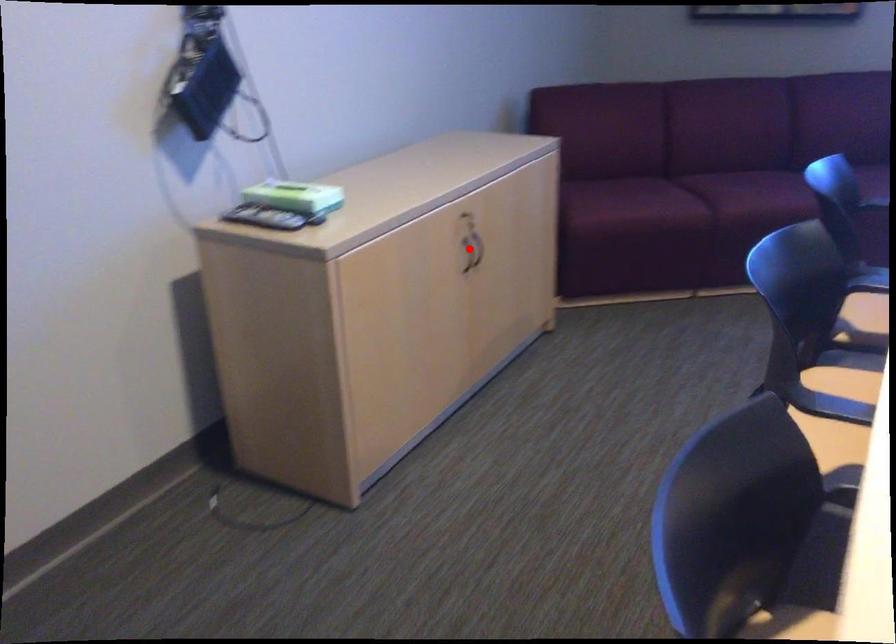
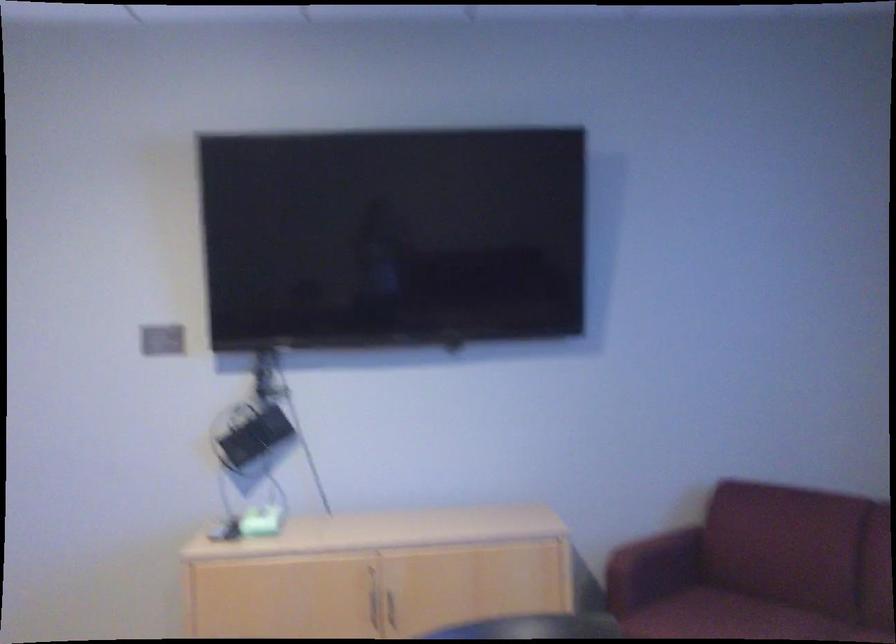
Question: I am providing you with two images of the same scene from different viewpoints. Image1 has a red point marked. In image2, the corresponding 3D location appears at what relative position? Reply with the corresponding letter.

Choices:
 (A) Closer
 (B) Farther

Answer: (B)